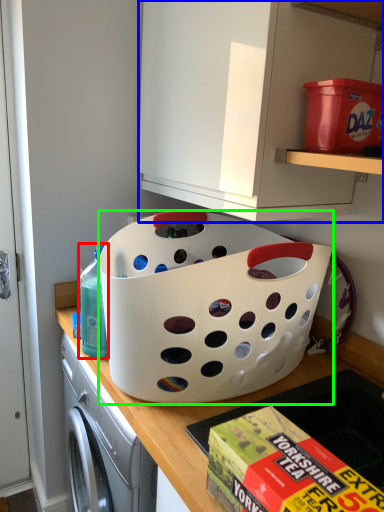
Question: Which object is the closest to the cleaning product (highlighted by a red box)? Choose among these: cabinetry (highlighted by a blue box) or basket (highlighted by a green box).

Choices:
 (A) cabinetry
 (B) basket

Answer: (B)